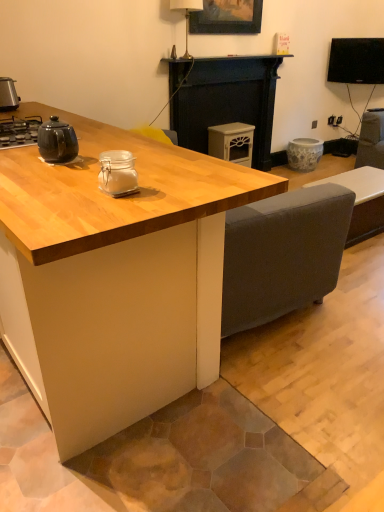
Find the location of a particular element. The height and width of the screenshot is (512, 384). clear glass jar at center, which appears as the third appliance when viewed from the right is located at coordinates (117, 173).

What do you see at coordinates (227, 17) in the screenshot?
I see `wooden picture frame at upper center` at bounding box center [227, 17].

Image resolution: width=384 pixels, height=512 pixels. What do you see at coordinates (356, 61) in the screenshot? I see `black glossy tv at upper right` at bounding box center [356, 61].

The width and height of the screenshot is (384, 512). Find the location of `white ceramic lamp at upper center`. white ceramic lamp at upper center is located at coordinates (186, 16).

What is the approximate width of white ceramic lamp at upper center?

white ceramic lamp at upper center is 10.22 inches in width.

Locate an element on the screen. The width and height of the screenshot is (384, 512). matte black teapot at left is located at coordinates (57, 141).

Is white ceramic lamp at upper center positioned beyond the bounds of metallic silver toaster at left, marked as the 3th appliance in a back-to-front arrangement?

white ceramic lamp at upper center lies outside metallic silver toaster at left, marked as the 3th appliance in a back-to-front arrangement,'s area.

In terms of height, does white ceramic lamp at upper center look taller or shorter compared to metallic silver toaster at left, marked as the 3th appliance in a back-to-front arrangement?

Clearly, white ceramic lamp at upper center is taller compared to metallic silver toaster at left, marked as the 3th appliance in a back-to-front arrangement.

In terms of width, does white ceramic lamp at upper center look wider or thinner when compared to metallic silver toaster at left, which is counted as the 2th appliance, starting from the front?

Considering their sizes, white ceramic lamp at upper center looks broader than metallic silver toaster at left, which is counted as the 2th appliance, starting from the front.

In the scene shown: From the image's perspective, which one is positioned higher, matte cream cabinet at center, the 2th appliance viewed from the right, or metallic silver toaster at left, acting as the fourth appliance starting from the right?

From the image's view, matte cream cabinet at center, the 2th appliance viewed from the right, is above.

Is matte cream cabinet at center, the 2th appliance viewed from the right, aimed at metallic silver toaster at left, positioned as the first appliance in left-to-right order?

No, matte cream cabinet at center, the 2th appliance viewed from the right, is not turned towards metallic silver toaster at left, positioned as the first appliance in left-to-right order.

Looking at this image, in terms of width, does matte cream cabinet at center, the 3th appliance from the front, look wider or thinner when compared to metallic silver toaster at left, acting as the fourth appliance starting from the right?

matte cream cabinet at center, the 3th appliance from the front, is wider than metallic silver toaster at left, acting as the fourth appliance starting from the right.

Considering the relative sizes of porcelain floral pot at center, which ranks as the 4th appliance in left-to-right order, and white ceramic lamp at upper center in the image provided, is porcelain floral pot at center, which ranks as the 4th appliance in left-to-right order, thinner than white ceramic lamp at upper center?

In fact, porcelain floral pot at center, which ranks as the 4th appliance in left-to-right order, might be wider than white ceramic lamp at upper center.

Between porcelain floral pot at center, which is counted as the first appliance, starting from the right, and white ceramic lamp at upper center, which one is positioned behind?

porcelain floral pot at center, which is counted as the first appliance, starting from the right, is further away from the camera.

Consider the image. Is porcelain floral pot at center, positioned as the 4th appliance in front-to-back order, beside white ceramic lamp at upper center?

porcelain floral pot at center, positioned as the 4th appliance in front-to-back order, is not next to white ceramic lamp at upper center, and they're not touching.

What's the angular difference between light wood table at center and matte cream cabinet at center, the 2th appliance viewed from the right,'s facing directions?

The facing directions of light wood table at center and matte cream cabinet at center, the 2th appliance viewed from the right, are 90 degrees apart.

Consider the image. Is light wood table at center looking in the opposite direction of matte cream cabinet at center, the 2th appliance viewed from the right?

Yes, light wood table at center's orientation is away from matte cream cabinet at center, the 2th appliance viewed from the right.

This screenshot has height=512, width=384. In order to click on table below the matte cream cabinet at center, which is counted as the second appliance, starting from the back (from the image's perspective) in this screenshot , I will do `click(114, 277)`.

Is point (0, 96) farther from viewer compared to point (221, 140)?

No, it is not.

Locate an element on the screen. The width and height of the screenshot is (384, 512). appliance that is the 1st one when counting downward from the matte cream cabinet at center, marked as the third appliance in a left-to-right arrangement (from the image's perspective) is located at coordinates (8, 94).

Is metallic silver toaster at left, marked as the 3th appliance in a back-to-front arrangement, completely or partially outside of matte cream cabinet at center, marked as the third appliance in a left-to-right arrangement?

Indeed, metallic silver toaster at left, marked as the 3th appliance in a back-to-front arrangement, is completely outside matte cream cabinet at center, marked as the third appliance in a left-to-right arrangement.

Considering the sizes of objects metallic silver toaster at left, marked as the 3th appliance in a back-to-front arrangement, and matte cream cabinet at center, which is counted as the second appliance, starting from the back, in the image provided, who is smaller, metallic silver toaster at left, marked as the 3th appliance in a back-to-front arrangement, or matte cream cabinet at center, which is counted as the second appliance, starting from the back,?

Smaller between the two is metallic silver toaster at left, marked as the 3th appliance in a back-to-front arrangement.

From the picture: Who is shorter, porcelain floral pot at center, which ranks as the 4th appliance in left-to-right order, or light wood table at center?

Standing shorter between the two is porcelain floral pot at center, which ranks as the 4th appliance in left-to-right order.

Could you tell me if porcelain floral pot at center, which is counted as the first appliance, starting from the right, is facing light wood table at center?

No, porcelain floral pot at center, which is counted as the first appliance, starting from the right, does not turn towards light wood table at center.

How much distance is there between porcelain floral pot at center, arranged as the 1th appliance when viewed from the back, and light wood table at center?

porcelain floral pot at center, arranged as the 1th appliance when viewed from the back, and light wood table at center are 3.34 meters apart.

Can you tell me how much porcelain floral pot at center, which is counted as the first appliance, starting from the right, and light wood table at center differ in facing direction?

The facing directions of porcelain floral pot at center, which is counted as the first appliance, starting from the right, and light wood table at center are 88.3 degrees apart.

Consider the image. From a real-world perspective, is matte cream cabinet at center, which is counted as the second appliance, starting from the back, positioned under clear glass jar at center, which is counted as the 4th appliance, starting from the back, based on gravity?

Yes, from a real-world perspective, matte cream cabinet at center, which is counted as the second appliance, starting from the back, is beneath clear glass jar at center, which is counted as the 4th appliance, starting from the back.

Which object is positioned more to the right, matte cream cabinet at center, the 2th appliance viewed from the right, or clear glass jar at center, which is counted as the 4th appliance, starting from the back?

Positioned to the right is matte cream cabinet at center, the 2th appliance viewed from the right.

Could you tell me if matte cream cabinet at center, the 2th appliance viewed from the right, is turned towards clear glass jar at center, which ranks as the 2th appliance in left-to-right order?

No, matte cream cabinet at center, the 2th appliance viewed from the right, is not oriented towards clear glass jar at center, which ranks as the 2th appliance in left-to-right order.

Is matte cream cabinet at center, the 3th appliance from the front, bigger than clear glass jar at center, which appears as the third appliance when viewed from the right?

Indeed, matte cream cabinet at center, the 3th appliance from the front, has a larger size compared to clear glass jar at center, which appears as the third appliance when viewed from the right.

Image resolution: width=384 pixels, height=512 pixels. Identify the location of lamp behind the metallic silver toaster at left, marked as the 3th appliance in a back-to-front arrangement. (186, 16).

What are the coordinates of `the 2nd appliance to the left when counting from the matte cream cabinet at center, the 3th appliance from the front` in the screenshot? It's located at (8, 94).

In the scene shown: Which object lies further to the anchor point clear glass jar at center, which appears as the third appliance when viewed from the right, matte cream cabinet at center, which is counted as the second appliance, starting from the back, or wooden picture frame at upper center?

wooden picture frame at upper center.

In the scene shown: Looking at the image, which one is located closer to light wood table at center, matte cream cabinet at center, the 3th appliance from the front, or porcelain floral pot at center, positioned as the 4th appliance in front-to-back order?

matte cream cabinet at center, the 3th appliance from the front, is positioned closer to the anchor light wood table at center.

Considering their positions, is black matte fireplace at center positioned closer to white ceramic lamp at upper center than light wood table at center?

Based on the image, black matte fireplace at center appears to be nearer to white ceramic lamp at upper center.

When comparing their distances from light wood table at center, does matte black teapot at left or clear glass jar at center, which is counted as the 4th appliance, starting from the back, seem closer?

Based on the image, clear glass jar at center, which is counted as the 4th appliance, starting from the back, appears to be nearer to light wood table at center.

Which object lies nearer to the anchor point matte cream cabinet at center, the 2th appliance viewed from the right, metallic silver toaster at left, marked as the 3th appliance in a back-to-front arrangement, or matte black teapot at left?

metallic silver toaster at left, marked as the 3th appliance in a back-to-front arrangement.

From the image, which object appears to be nearer to porcelain floral pot at center, arranged as the 1th appliance when viewed from the back, light wood table at center or white ceramic lamp at upper center?

Based on the image, white ceramic lamp at upper center appears to be nearer to porcelain floral pot at center, arranged as the 1th appliance when viewed from the back.

Looking at the image, which one is located further to wooden picture frame at upper center, matte cream cabinet at center, which is counted as the second appliance, starting from the back, or light wood table at center?

light wood table at center lies further to wooden picture frame at upper center than the other object.

Looking at the image, which one is located closer to black matte fireplace at center, black glossy tv at upper right or clear glass jar at center, which is the first appliance in front-to-back order?

Among the two, black glossy tv at upper right is located nearer to black matte fireplace at center.

Locate an element on the screen. This screenshot has height=512, width=384. picture frame between metallic silver toaster at left, which is counted as the 2th appliance, starting from the front, and black matte fireplace at center, in the horizontal direction is located at coordinates [x=227, y=17].

At what (x,y) coordinates should I click in order to perform the action: click on fireplace between white ceramic lamp at upper center and matte cream cabinet at center, marked as the third appliance in a left-to-right arrangement, in the up-down direction. Please return your answer as a coordinate pair (x, y). This screenshot has width=384, height=512. Looking at the image, I should click on (228, 102).

At what (x,y) coordinates should I click in order to perform the action: click on picture frame between light wood table at center and black glossy tv at upper right along the z-axis. Please return your answer as a coordinate pair (x, y). The image size is (384, 512). Looking at the image, I should click on (227, 17).

This screenshot has height=512, width=384. I want to click on appliance between matte cream cabinet at center, the 3th appliance from the front, and black glossy tv at upper right, in the horizontal direction, so click(x=304, y=154).